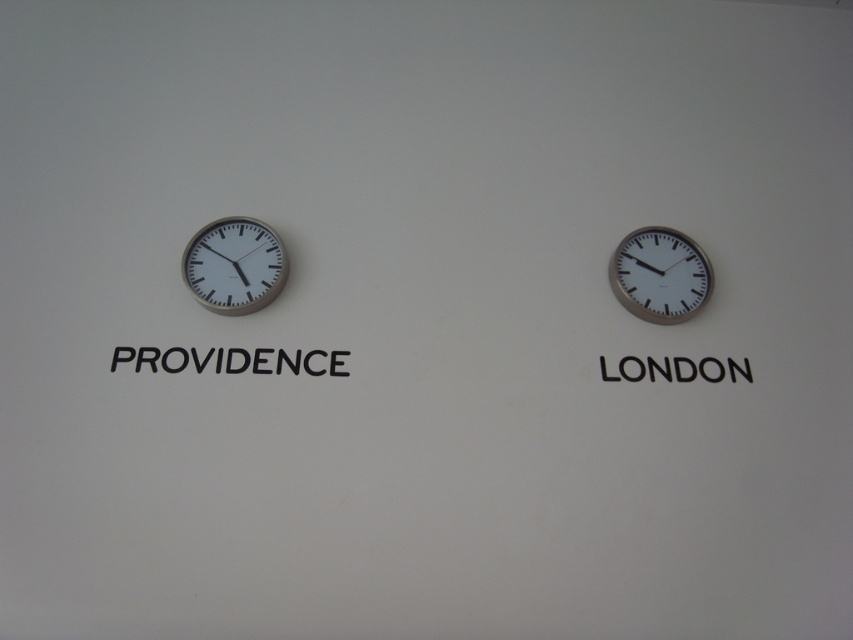
In the scene shown: Which of these two, white metallic clock at right or blackmaterial/texturelondon at right, stands shorter?

blackmaterial/texturelondon at right

Who is positioned more to the left, white metallic clock at right or blackmaterial/texturelondon at right?

Positioned to the left is white metallic clock at right.

Between point (688, 269) and point (611, 378), which one is positioned in front?

Point (611, 378) is in front.

Find the location of `white metallic clock at right`. white metallic clock at right is located at coordinates (659, 275).

Locate an element on the screen. This screenshot has width=853, height=640. silver metallic clock at left is located at coordinates (234, 266).

This screenshot has height=640, width=853. What do you see at coordinates (234, 266) in the screenshot? I see `silver metallic clock at left` at bounding box center [234, 266].

Where is `silver metallic clock at left`? The width and height of the screenshot is (853, 640). silver metallic clock at left is located at coordinates (234, 266).

Who is positioned more to the right, silver metallic clock at left or white metallic clock at right?

white metallic clock at right is more to the right.

This screenshot has height=640, width=853. In order to click on silver metallic clock at left in this screenshot , I will do `click(234, 266)`.

This screenshot has width=853, height=640. I want to click on silver metallic clock at left, so click(234, 266).